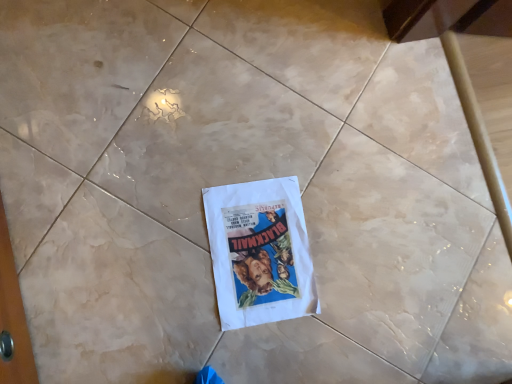
Find the location of `free space to the left of white paper flyer at center`. free space to the left of white paper flyer at center is located at coordinates (170, 188).